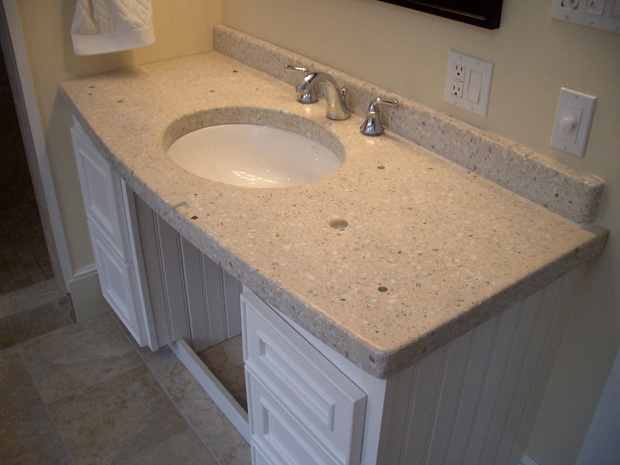
I want to click on tiled floor, so click(89, 413).